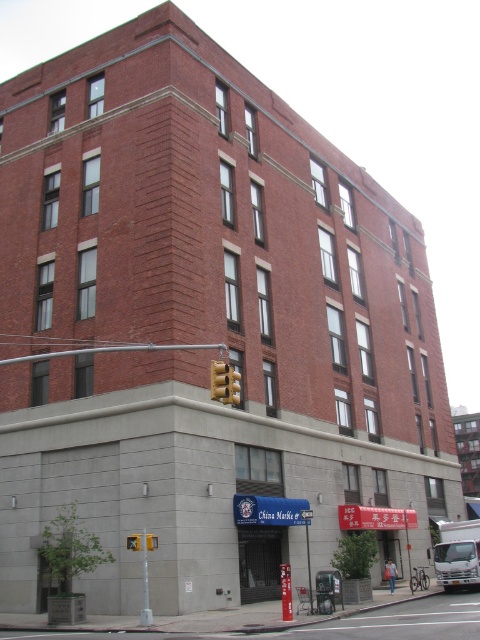
In the scene shown: Between yellow matte traffic light at upper center and yellow plastic traffic light at lower center, which one is positioned higher?

yellow matte traffic light at upper center is higher up.

Does yellow matte traffic light at upper center come in front of yellow plastic traffic light at lower center?

Yes, it is in front of yellow plastic traffic light at lower center.

Image resolution: width=480 pixels, height=640 pixels. What do you see at coordinates (225, 384) in the screenshot?
I see `yellow matte traffic light at upper center` at bounding box center [225, 384].

Locate an element on the screen. This screenshot has height=640, width=480. yellow matte traffic light at upper center is located at coordinates (225, 384).

Who is taller, yellow plastic traffic light at upper center or yellow plastic traffic light at lower center?

Standing taller between the two is yellow plastic traffic light at lower center.

Does point (140, 547) come farther from viewer compared to point (148, 545)?

No, (140, 547) is in front of (148, 545).

Identify the location of yellow plastic traffic light at upper center. (133, 541).

Identify the location of yellow plastic traffic light at upper center. (133, 541).

Can you confirm if yellow matte traffic light at upper center is thinner than yellow plastic traffic light at upper center?

No, yellow matte traffic light at upper center is not thinner than yellow plastic traffic light at upper center.

Which is more to the right, yellow matte traffic light at upper center or yellow plastic traffic light at upper center?

yellow matte traffic light at upper center is more to the right.

This screenshot has height=640, width=480. I want to click on yellow matte traffic light at upper center, so click(225, 384).